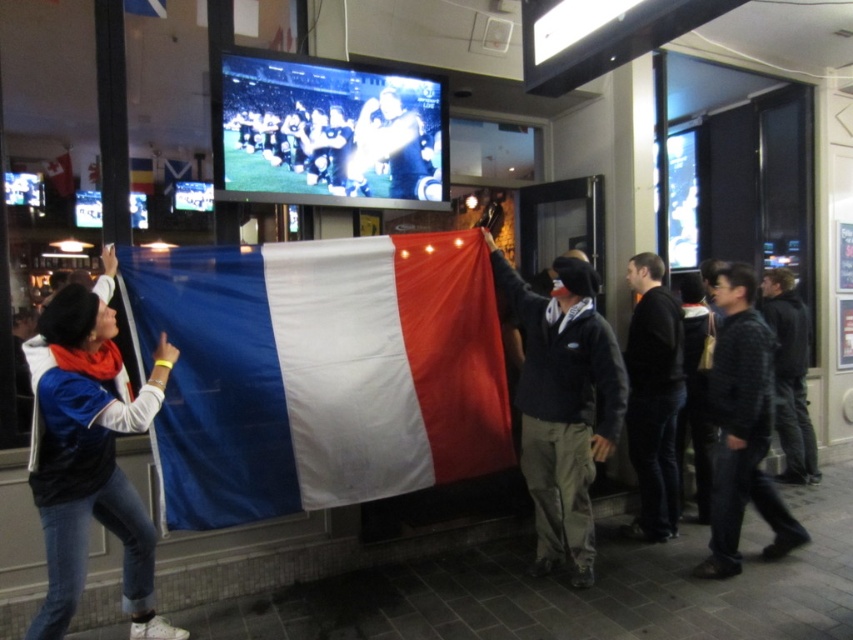
Who is more distant from viewer, [33,340] or [775,333]?

Point [775,333]

Where is `blue fabric flag at left`? Image resolution: width=853 pixels, height=640 pixels. blue fabric flag at left is located at coordinates (90, 456).

Image resolution: width=853 pixels, height=640 pixels. What do you see at coordinates (90, 456) in the screenshot? I see `blue fabric flag at left` at bounding box center [90, 456].

The width and height of the screenshot is (853, 640). In order to click on blue fabric flag at left in this screenshot , I will do `click(90, 456)`.

Can you confirm if blue fabric flag at left is wider than black smooth jacket at right?

Yes, blue fabric flag at left is wider than black smooth jacket at right.

Can you confirm if blue fabric flag at left is taller than black smooth jacket at right?

Indeed, blue fabric flag at left has a greater height compared to black smooth jacket at right.

Where is `blue fabric flag at left`? The height and width of the screenshot is (640, 853). blue fabric flag at left is located at coordinates (90, 456).

Between point (511, 440) and point (648, 483), which one is positioned behind?

The point (648, 483) is more distant.

Can you confirm if matte fabric flag at center is positioned to the right of black smooth jacket at right?

Incorrect, matte fabric flag at center is not on the right side of black smooth jacket at right.

Locate an element on the screen. Image resolution: width=853 pixels, height=640 pixels. matte fabric flag at center is located at coordinates click(318, 371).

The image size is (853, 640). In order to click on matte fabric flag at center in this screenshot , I will do `click(318, 371)`.